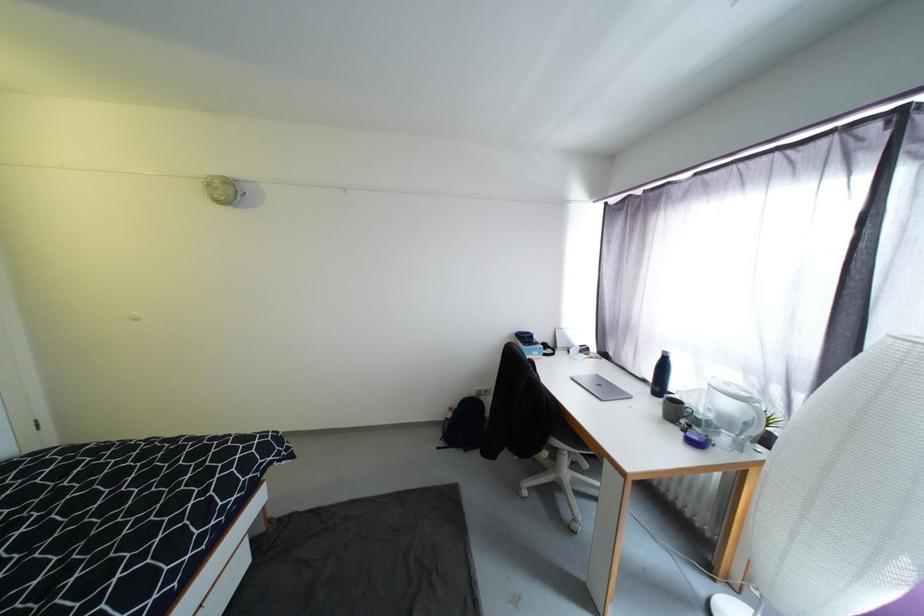
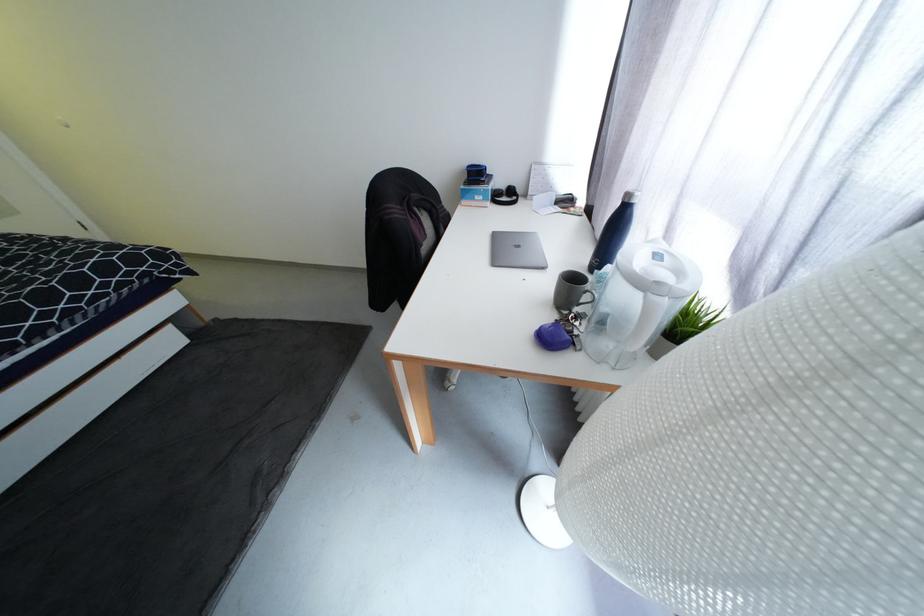
Find the pixel in the second image that matches (x=541, y=352) in the first image.

(484, 195)